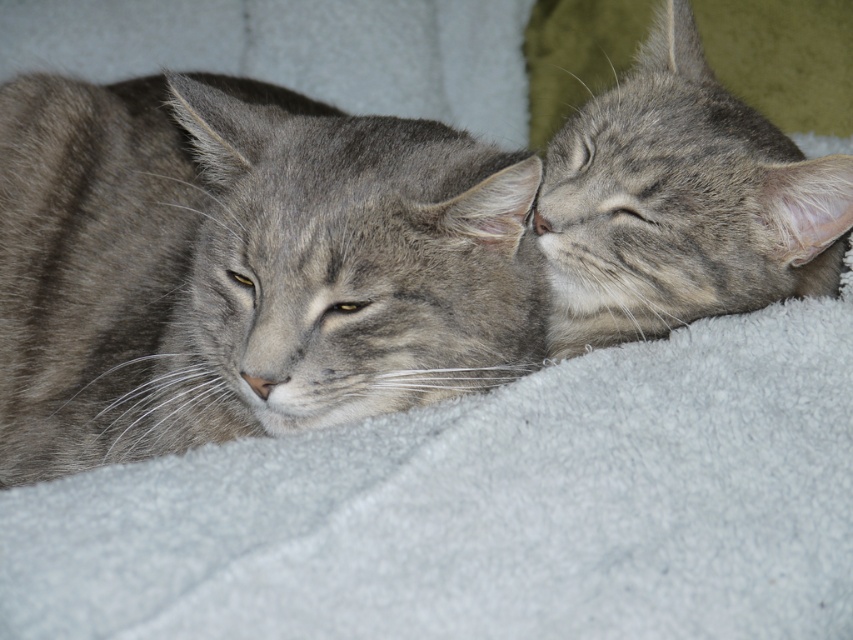
Which is below, gray striped cat at left or gray tabby cat at upper right?

gray striped cat at left is lower down.

This screenshot has width=853, height=640. What do you see at coordinates (242, 266) in the screenshot?
I see `gray striped cat at left` at bounding box center [242, 266].

Where is `gray striped cat at left`? The image size is (853, 640). gray striped cat at left is located at coordinates (242, 266).